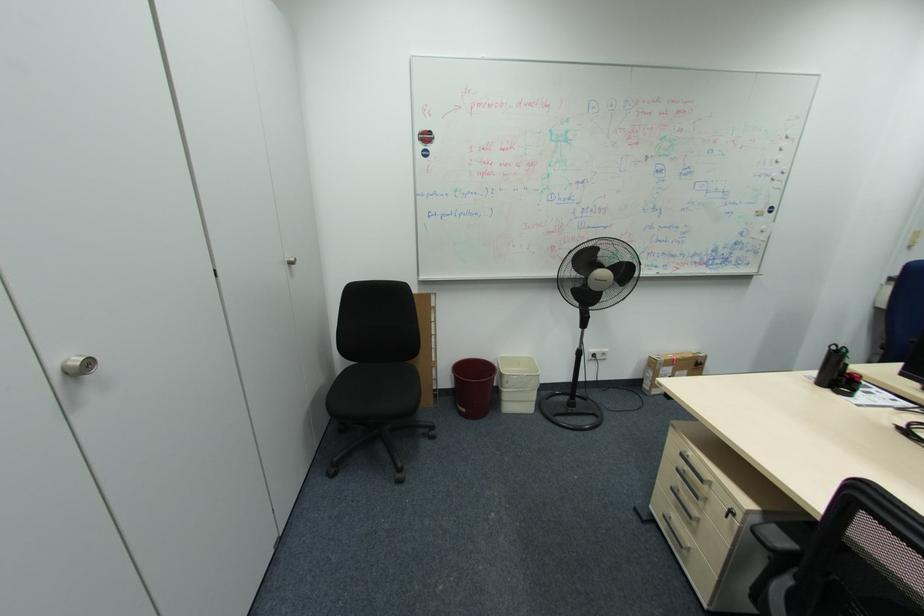
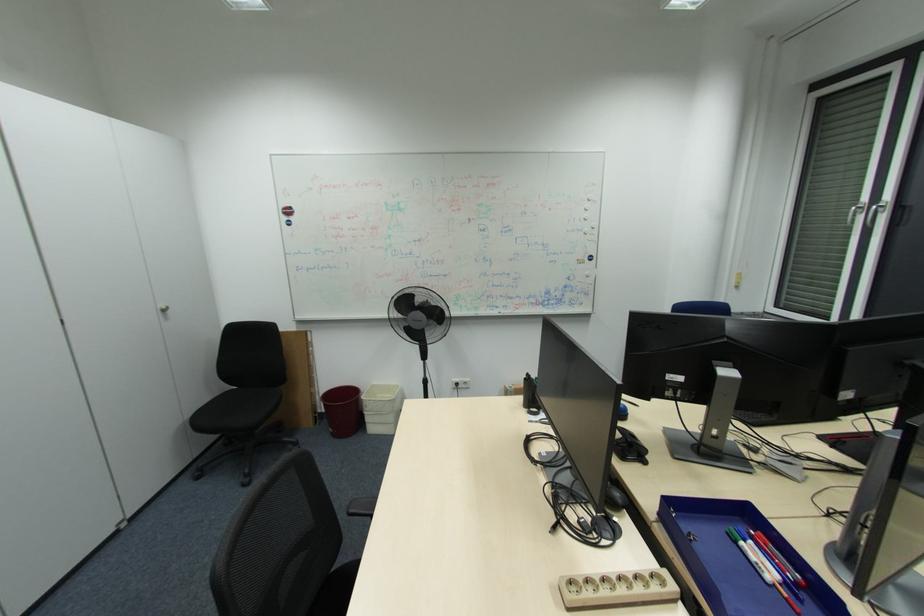
Question: Which direction would the cameraman need to move to produce the second image? Reply with the corresponding letter.

Choices:
 (A) Left
 (B) Right
 (C) Forward
 (D) Backward

Answer: (B)